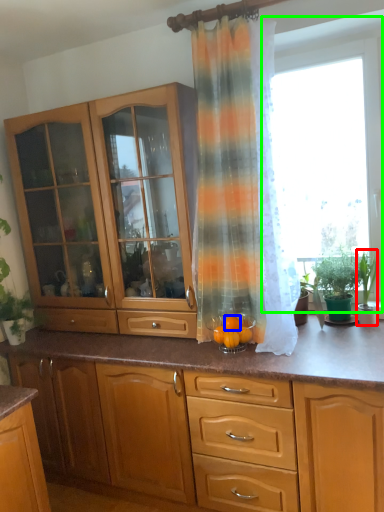
Question: Estimate the real-world distances between objects in this image. Which object is closer to houseplant (highlighted by a red box), orange (highlighted by a blue box) or window screen (highlighted by a green box)?

Choices:
 (A) orange
 (B) window screen

Answer: (B)